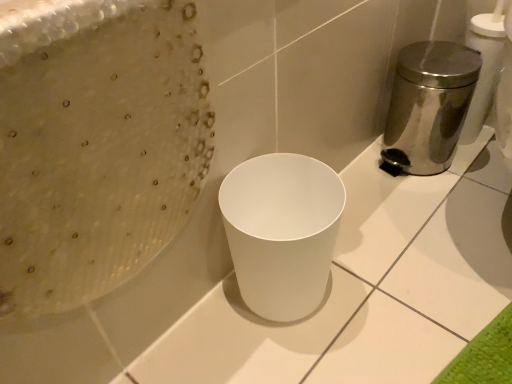
Where is `polished stainless steel trash can at right`? polished stainless steel trash can at right is located at coordinates (428, 106).

What do you see at coordinates (428, 106) in the screenshot? I see `polished stainless steel trash can at right` at bounding box center [428, 106].

Measure the distance between white matte waste container at center and camera.

A distance of 22.96 inches exists between white matte waste container at center and camera.

You are a GUI agent. You are given a task and a screenshot of the screen. Output one action in this format:
    pyautogui.click(x=<x>, y=<y>)
    Task: Click on the white matte waste container at center
    
    Given the screenshot: What is the action you would take?
    pyautogui.click(x=282, y=231)

Image resolution: width=512 pixels, height=384 pixels. Describe the element at coordinates (282, 231) in the screenshot. I see `white matte waste container at center` at that location.

Consider the image. Measure the distance between point (286, 199) and camera.

A distance of 77.10 centimeters exists between point (286, 199) and camera.

Image resolution: width=512 pixels, height=384 pixels. In order to click on polished stainless steel trash can at right in this screenshot , I will do `click(428, 106)`.

Is white matte waste container at center at the right side of polished stainless steel trash can at right?

Incorrect, white matte waste container at center is not on the right side of polished stainless steel trash can at right.

Which object is more forward, white matte waste container at center or polished stainless steel trash can at right?

white matte waste container at center is closer to the camera.

Is point (302, 288) positioned after point (433, 68)?

No, (302, 288) is closer to viewer.

From the image's perspective, relative to polished stainless steel trash can at right, is white matte waste container at center above or below?

Clearly, from the image's perspective, white matte waste container at center is below polished stainless steel trash can at right.

From a real-world perspective, is white matte waste container at center under polished stainless steel trash can at right?

Indeed, from a real-world perspective, white matte waste container at center is positioned beneath polished stainless steel trash can at right.

Based on the photo, is white matte waste container at center thinner than polished stainless steel trash can at right?

Yes.

Is white matte waste container at center shorter than polished stainless steel trash can at right?

Indeed, white matte waste container at center has a lesser height compared to polished stainless steel trash can at right.

Between white matte waste container at center and polished stainless steel trash can at right, which one has smaller size?

Smaller between the two is white matte waste container at center.

Which is correct: white matte waste container at center is inside polished stainless steel trash can at right, or outside of it?

white matte waste container at center is not inside polished stainless steel trash can at right, it's outside.

Does white matte waste container at center touch polished stainless steel trash can at right?

They are not placed beside each other.

Is white matte waste container at center oriented towards polished stainless steel trash can at right?

No, white matte waste container at center is not turned towards polished stainless steel trash can at right.

Can you tell me how much white matte waste container at center and polished stainless steel trash can at right differ in facing direction?

The facing directions of white matte waste container at center and polished stainless steel trash can at right are 91.3 degrees apart.

Identify the location of waste container below the polished stainless steel trash can at right (from the image's perspective). This screenshot has width=512, height=384. (282, 231).

Is polished stainless steel trash can at right to the left of white matte waste container at center from the viewer's perspective?

In fact, polished stainless steel trash can at right is to the right of white matte waste container at center.

Does polished stainless steel trash can at right come in front of white matte waste container at center?

No, polished stainless steel trash can at right is behind white matte waste container at center.

Which is closer to the camera, (404, 68) or (224, 220)?

Point (404, 68).

In the scene shown: From the image's perspective, which one is positioned lower, polished stainless steel trash can at right or white matte waste container at center?

From the image's view, white matte waste container at center is below.

In the scene shown: From a real-world perspective, is polished stainless steel trash can at right physically below white matte waste container at center?

No, from a real-world perspective, polished stainless steel trash can at right is not under white matte waste container at center.

Is polished stainless steel trash can at right thinner than white matte waste container at center?

In fact, polished stainless steel trash can at right might be wider than white matte waste container at center.

Which of these two, polished stainless steel trash can at right or white matte waste container at center, stands shorter?

white matte waste container at center is shorter.

Considering the relative sizes of polished stainless steel trash can at right and white matte waste container at center in the image provided, is polished stainless steel trash can at right smaller than white matte waste container at center?

No.

Would you say polished stainless steel trash can at right is outside white matte waste container at center?

Indeed, polished stainless steel trash can at right is completely outside white matte waste container at center.

Is polished stainless steel trash can at right placed right next to white matte waste container at center?

No.

Is polished stainless steel trash can at right oriented towards white matte waste container at center?

Yes, polished stainless steel trash can at right faces towards white matte waste container at center.

How many degrees apart are the facing directions of polished stainless steel trash can at right and white matte waste container at center?

91.3 degrees.

Where is `appliance above the white matte waste container at center (from a real-world perspective)`? The image size is (512, 384). appliance above the white matte waste container at center (from a real-world perspective) is located at coordinates (428, 106).

At what (x,y) coordinates should I click in order to perform the action: click on appliance above the white matte waste container at center (from a real-world perspective). Please return your answer as a coordinate pair (x, y). This screenshot has height=384, width=512. Looking at the image, I should click on (428, 106).

Where is `appliance behind the white matte waste container at center`? Image resolution: width=512 pixels, height=384 pixels. appliance behind the white matte waste container at center is located at coordinates (428, 106).